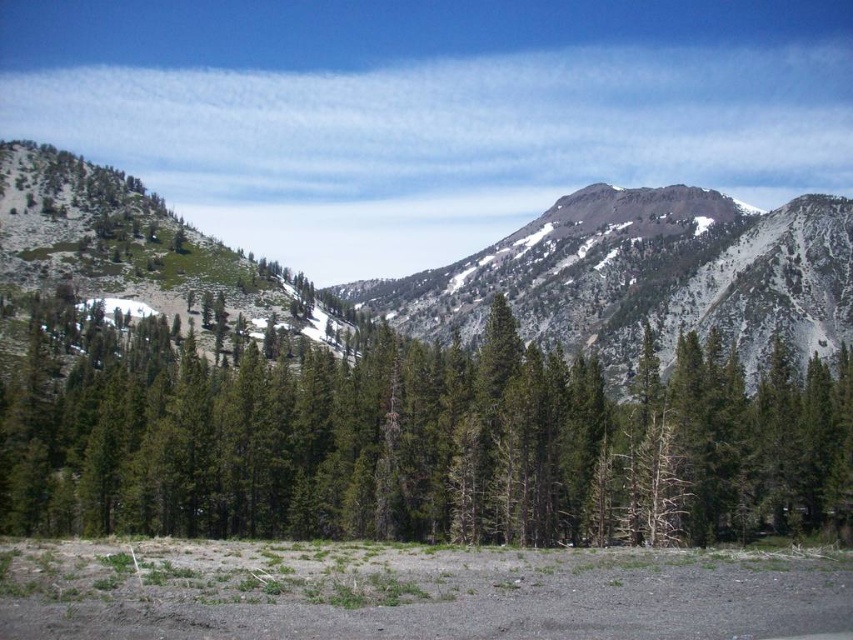
You are standing at the origin point of the coordinate system in the mountain landscape. You want to locate the green matte tree at center. What are its coordinates?

The green matte tree at center is located at point coordinates of 0.691 in the x axis and 0.487 in the y axis.

You are a hiker planning to take a photo of the green matte tree at center and the green textured mountain at center from a distance. Which object will appear smaller in the photo?

The green matte tree at center will appear smaller in the photo because it is shorter than the green textured mountain at center.